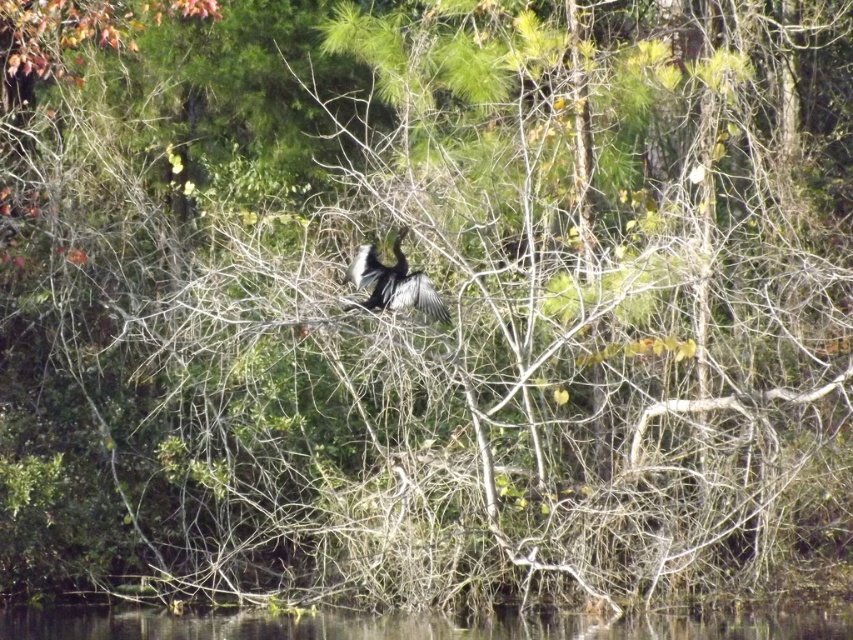
Question: Observing the image, what is the correct spatial positioning of clear water at lower center in reference to black glossy bird at center?

Choices:
 (A) right
 (B) left

Answer: (A)

Question: Which point appears closest to the camera in this image?

Choices:
 (A) (96, 625)
 (B) (401, 301)

Answer: (B)

Question: Can you confirm if clear water at lower center is wider than black glossy bird at center?

Choices:
 (A) yes
 (B) no

Answer: (A)

Question: Is clear water at lower center smaller than black glossy bird at center?

Choices:
 (A) no
 (B) yes

Answer: (A)